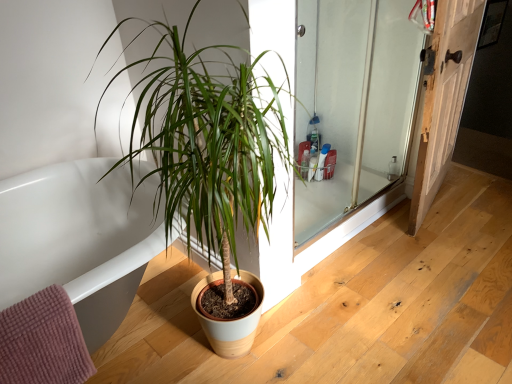
Find the location of a particular element. vacant area that is in front of wooden door at right is located at coordinates (446, 253).